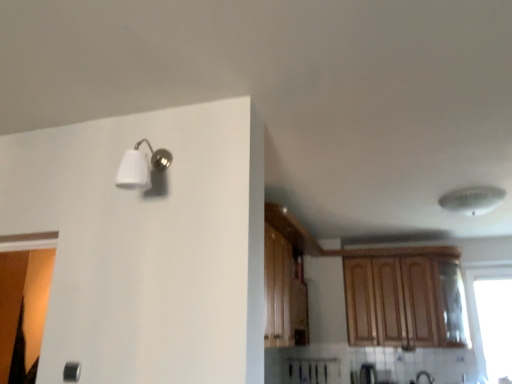
Identify the location of transparent glass window at right. The width and height of the screenshot is (512, 384). (475, 304).

Where is `window behind the white plastic ceiling fan at upper right`? window behind the white plastic ceiling fan at upper right is located at coordinates (475, 304).

Considering the positions of objects white plastic ceiling fan at upper right and transparent glass window at right in the image provided, who is more to the left, white plastic ceiling fan at upper right or transparent glass window at right?

white plastic ceiling fan at upper right.

Considering the sizes of white plastic ceiling fan at upper right and transparent glass window at right in the image, is white plastic ceiling fan at upper right wider or thinner than transparent glass window at right?

Clearly, white plastic ceiling fan at upper right has more width compared to transparent glass window at right.

Between white matte light fixture at upper left and wooden cabinet at upper right, which one is positioned in front?

white matte light fixture at upper left is more forward.

From the image's perspective, which object appears higher, white matte light fixture at upper left or wooden cabinet at upper right?

white matte light fixture at upper left appears higher in the image.

Which is behind, point (117, 173) or point (442, 269)?

The point (442, 269) is farther from the camera.

Measure the distance between white plastic ceiling fan at upper right and white matte light fixture at upper left.

white plastic ceiling fan at upper right is 2.46 meters from white matte light fixture at upper left.

From a real-world perspective, is white plastic ceiling fan at upper right on white matte light fixture at upper left?

Yes, from a real-world perspective, white plastic ceiling fan at upper right is above white matte light fixture at upper left.

Is white plastic ceiling fan at upper right looking in the opposite direction of white matte light fixture at upper left?

white plastic ceiling fan at upper right is not turned away from white matte light fixture at upper left.

Looking at this image, is white plastic ceiling fan at upper right inside or outside of white matte light fixture at upper left?

white plastic ceiling fan at upper right is spatially situated outside white matte light fixture at upper left.

Which is in front, transparent glass window at right or white plastic ceiling fan at upper right?

Positioned in front is white plastic ceiling fan at upper right.

Which of these two, transparent glass window at right or white plastic ceiling fan at upper right, is smaller?

white plastic ceiling fan at upper right.

I want to click on window below the white plastic ceiling fan at upper right (from the image's perspective), so click(x=475, y=304).

Between transparent glass window at right and white plastic ceiling fan at upper right, which one appears on the right side from the viewer's perspective?

transparent glass window at right.

Which of these two, transparent glass window at right or white matte light fixture at upper left, is thinner?

transparent glass window at right.

From the image's perspective, relative to white matte light fixture at upper left, is transparent glass window at right above or below?

Clearly, from the image's perspective, transparent glass window at right is below white matte light fixture at upper left.

Is transparent glass window at right to the left of white matte light fixture at upper left from the viewer's perspective?

Incorrect, transparent glass window at right is not on the left side of white matte light fixture at upper left.

From a real-world perspective, between transparent glass window at right and wooden cabinet at upper right, who is vertically lower?

transparent glass window at right is physically lower.

Is transparent glass window at right outside of wooden cabinet at upper right?

transparent glass window at right lies outside wooden cabinet at upper right's area.

Is white matte light fixture at upper left bigger than white plastic ceiling fan at upper right?

Actually, white matte light fixture at upper left might be smaller than white plastic ceiling fan at upper right.

Does white matte light fixture at upper left have a greater width compared to white plastic ceiling fan at upper right?

No.

Is white matte light fixture at upper left at the right side of white plastic ceiling fan at upper right?

No, white matte light fixture at upper left is not to the right of white plastic ceiling fan at upper right.

Are white matte light fixture at upper left and white plastic ceiling fan at upper right far apart?

white matte light fixture at upper left is far away from white plastic ceiling fan at upper right.

At what (x,y) coordinates should I click in order to perform the action: click on window behind the white plastic ceiling fan at upper right. Please return your answer as a coordinate pair (x, y). The height and width of the screenshot is (384, 512). Looking at the image, I should click on (475, 304).

The image size is (512, 384). Find the location of `cabinetry below the white matte light fixture at upper left (from a real-world perspective)`. cabinetry below the white matte light fixture at upper left (from a real-world perspective) is located at coordinates (403, 297).

Considering their positions, is white matte light fixture at upper left positioned closer to wooden cabinet at upper right than white plastic ceiling fan at upper right?

white plastic ceiling fan at upper right.

From the image, which object appears to be farther from white plastic ceiling fan at upper right, white matte light fixture at upper left or transparent glass window at right?

white matte light fixture at upper left lies further to white plastic ceiling fan at upper right than the other object.

Consider the image. From the image, which object appears to be farther from white matte light fixture at upper left, wooden cabinet at upper right or transparent glass window at right?

The object further to white matte light fixture at upper left is transparent glass window at right.

Based on their spatial positions, is transparent glass window at right or white matte light fixture at upper left further from wooden cabinet at upper right?

white matte light fixture at upper left lies further to wooden cabinet at upper right than the other object.

When comparing their distances from transparent glass window at right, does white plastic ceiling fan at upper right or wooden cabinet at upper right seem closer?

Based on the image, wooden cabinet at upper right appears to be nearer to transparent glass window at right.

Estimate the real-world distances between objects in this image. Which object is further from white matte light fixture at upper left, transparent glass window at right or wooden cabinet at upper right?

transparent glass window at right is positioned further to the anchor white matte light fixture at upper left.

From the image, which object appears to be farther from transparent glass window at right, white matte light fixture at upper left or white plastic ceiling fan at upper right?

white matte light fixture at upper left is positioned further to the anchor transparent glass window at right.

When comparing their distances from white plastic ceiling fan at upper right, does transparent glass window at right or white matte light fixture at upper left seem further?

Among the two, white matte light fixture at upper left is located further to white plastic ceiling fan at upper right.

Find the location of `cabinetry located between white matte light fixture at upper left and transparent glass window at right in the left-right direction`. cabinetry located between white matte light fixture at upper left and transparent glass window at right in the left-right direction is located at coordinates 403,297.

At what (x,y) coordinates should I click in order to perform the action: click on cabinetry between white plastic ceiling fan at upper right and transparent glass window at right in the up-down direction. Please return your answer as a coordinate pair (x, y). Image resolution: width=512 pixels, height=384 pixels. Looking at the image, I should click on (403, 297).

Locate an element on the screen. This screenshot has width=512, height=384. lamp located between white matte light fixture at upper left and wooden cabinet at upper right in the depth direction is located at coordinates (472, 200).

Locate an element on the screen. The width and height of the screenshot is (512, 384). lamp between white matte light fixture at upper left and transparent glass window at right from left to right is located at coordinates (472, 200).